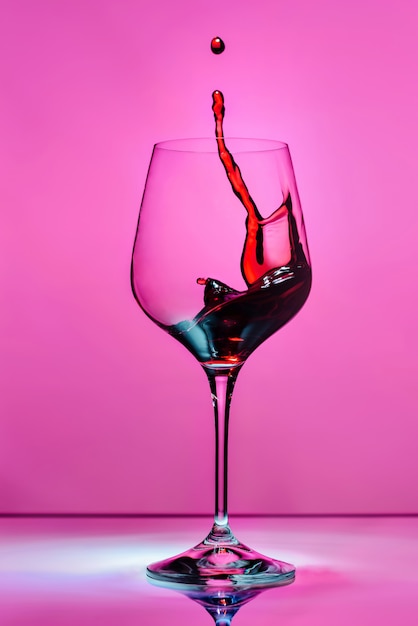
Find the location of a particular element. The image size is (418, 626). bottom of glass is located at coordinates (221, 577).